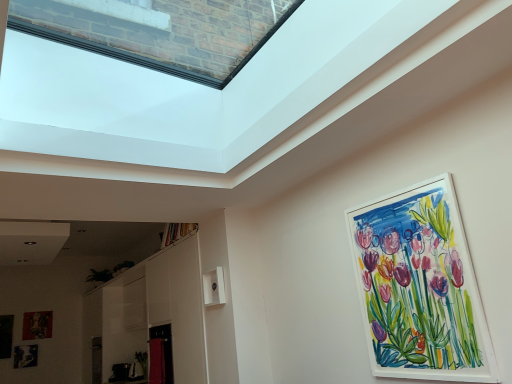
Locate an element on the screen. The width and height of the screenshot is (512, 384). matte black picture frame at lower left, the third picture frame from the top is located at coordinates (6, 336).

Find the location of a particular element. Image resolution: width=512 pixels, height=384 pixels. matte black picture frame at lower left, the second picture frame in the bottom-to-top sequence is located at coordinates (6, 336).

Would you say matte black picture frame at lower left, the third picture frame from the top, is part of metallic silver picture frame at lower left, arranged as the third picture frame when viewed from the right,'s contents?

Actually, matte black picture frame at lower left, the third picture frame from the top, is outside metallic silver picture frame at lower left, arranged as the third picture frame when viewed from the right.

Can you confirm if metallic silver picture frame at lower left, which is the 1th picture frame from bottom to top, is smaller than matte black picture frame at lower left, which is counted as the second picture frame, starting from the front?

Yes.

From the image's perspective, which one is positioned higher, metallic silver picture frame at lower left, which ranks as the 3th picture frame in front-to-back order, or matte black picture frame at lower left, the second picture frame in the bottom-to-top sequence?

matte black picture frame at lower left, the second picture frame in the bottom-to-top sequence, is shown above in the image.

Who is taller, metallic silver picture frame at lower left, which ranks as the 3th picture frame in front-to-back order, or matte black picture frame at lower left, the second picture frame in the bottom-to-top sequence?

matte black picture frame at lower left, the second picture frame in the bottom-to-top sequence.

Can you confirm if matte black picture frame at lower left, which is counted as the second picture frame, starting from the front, is shorter than watercolor paper painting at upper right, which ranks as the fourth picture frame in bottom-to-top order?

Indeed, matte black picture frame at lower left, which is counted as the second picture frame, starting from the front, has a lesser height compared to watercolor paper painting at upper right, which ranks as the fourth picture frame in bottom-to-top order.

Which object is further away from the camera taking this photo, matte black picture frame at lower left, which is counted as the second picture frame, starting from the front, or watercolor paper painting at upper right, the fourth picture frame from the back?

Positioned behind is matte black picture frame at lower left, which is counted as the second picture frame, starting from the front.

Considering the sizes of matte black picture frame at lower left, which is counted as the 4th picture frame, starting from the right, and watercolor paper painting at upper right, which ranks as the fourth picture frame in bottom-to-top order, in the image, is matte black picture frame at lower left, which is counted as the 4th picture frame, starting from the right, wider or thinner than watercolor paper painting at upper right, which ranks as the fourth picture frame in bottom-to-top order,?

Clearly, matte black picture frame at lower left, which is counted as the 4th picture frame, starting from the right, has more width compared to watercolor paper painting at upper right, which ranks as the fourth picture frame in bottom-to-top order.

Is watercolor paper painting at upper right, placed as the 1th picture frame when sorted from front to back, completely or partially inside matte black picture frame at lower left, the second picture frame in the bottom-to-top sequence?

No, watercolor paper painting at upper right, placed as the 1th picture frame when sorted from front to back, is not a part of matte black picture frame at lower left, the second picture frame in the bottom-to-top sequence.

Can you confirm if matte black picture frame at lower left, marked as the third picture frame in a left-to-right arrangement, is smaller than watercolor paper painting at upper right, marked as the 1th picture frame in a top-to-bottom arrangement?

Yes, matte black picture frame at lower left, marked as the third picture frame in a left-to-right arrangement, is smaller than watercolor paper painting at upper right, marked as the 1th picture frame in a top-to-bottom arrangement.

Could you tell me if matte black picture frame at lower left, which is counted as the 4th picture frame, starting from the front, is turned towards watercolor paper painting at upper right, placed as the 1th picture frame when sorted from front to back?

Yes.

Considering the points (48, 321) and (422, 349), which point is in front, point (48, 321) or point (422, 349)?

The point (422, 349) is more forward.

Is watercolor paper painting at upper right, which ranks as the fourth picture frame in bottom-to-top order, a part of matte black picture frame at lower left, which is counted as the 4th picture frame, starting from the front?

Actually, watercolor paper painting at upper right, which ranks as the fourth picture frame in bottom-to-top order, is outside matte black picture frame at lower left, which is counted as the 4th picture frame, starting from the front.

Are matte black picture frame at lower left, marked as the second picture frame in a right-to-left arrangement, and matte black picture frame at lower left, the third picture frame from the top, located far from each other?

No, there isn't a large distance between matte black picture frame at lower left, marked as the second picture frame in a right-to-left arrangement, and matte black picture frame at lower left, the third picture frame from the top.

Could you tell me if matte black picture frame at lower left, marked as the third picture frame in a left-to-right arrangement, is turned towards matte black picture frame at lower left, the third picture frame from the top?

No, matte black picture frame at lower left, marked as the third picture frame in a left-to-right arrangement, is not turned towards matte black picture frame at lower left, the third picture frame from the top.

From the image's perspective, which one is positioned higher, matte black picture frame at lower left, which is the 2th picture frame from top to bottom, or matte black picture frame at lower left, the third picture frame from the top?

matte black picture frame at lower left, which is the 2th picture frame from top to bottom, appears higher in the image.

Looking at this image, is watercolor paper painting at upper right, the fourth picture frame from the back, shorter than metallic silver picture frame at lower left, which ranks as the 3th picture frame in front-to-back order?

Incorrect, the height of watercolor paper painting at upper right, the fourth picture frame from the back, does not fall short of that of metallic silver picture frame at lower left, which ranks as the 3th picture frame in front-to-back order.

Are watercolor paper painting at upper right, the fourth picture frame from the back, and metallic silver picture frame at lower left, which is counted as the 4th picture frame, starting from the top, beside each other?

No, watercolor paper painting at upper right, the fourth picture frame from the back, is not touching metallic silver picture frame at lower left, which is counted as the 4th picture frame, starting from the top.

Is watercolor paper painting at upper right, the fourth picture frame from the back, bigger than metallic silver picture frame at lower left, arranged as the third picture frame when viewed from the right?

Indeed, watercolor paper painting at upper right, the fourth picture frame from the back, has a larger size compared to metallic silver picture frame at lower left, arranged as the third picture frame when viewed from the right.

From a real-world perspective, starting from the matte black picture frame at lower left, which is the 2th picture frame from top to bottom, which picture frame is the 3rd one below it? Please provide its 2D coordinates.

[(25, 356)]

Based on the photo, can you confirm if matte black picture frame at lower left, which is counted as the 3th picture frame, starting from the bottom, is smaller than metallic silver picture frame at lower left, arranged as the third picture frame when viewed from the right?

No.

From the image's perspective, is matte black picture frame at lower left, which is counted as the 3th picture frame, starting from the bottom, under metallic silver picture frame at lower left, which ranks as the 3th picture frame in front-to-back order?

No.

Which of these two, matte black picture frame at lower left, which ranks as the first picture frame in back-to-front order, or metallic silver picture frame at lower left, which is counted as the 4th picture frame, starting from the top, stands shorter?

metallic silver picture frame at lower left, which is counted as the 4th picture frame, starting from the top, is shorter.

Is point (4, 328) closer or farther from the camera than point (35, 366)?

Point (4, 328) is farther from the camera than point (35, 366).

Which object is positioned more to the right, matte black picture frame at lower left, which is counted as the 4th picture frame, starting from the right, or metallic silver picture frame at lower left, which is counted as the 4th picture frame, starting from the top?

metallic silver picture frame at lower left, which is counted as the 4th picture frame, starting from the top, is more to the right.

Are matte black picture frame at lower left, the 1th picture frame viewed from the left, and metallic silver picture frame at lower left, arranged as the third picture frame when viewed from the right, far apart?

No.

How different are the orientations of matte black picture frame at lower left, which is counted as the 4th picture frame, starting from the right, and metallic silver picture frame at lower left, arranged as the third picture frame when viewed from the right, in degrees?

There is a 4.48-degree angle between the facing directions of matte black picture frame at lower left, which is counted as the 4th picture frame, starting from the right, and metallic silver picture frame at lower left, arranged as the third picture frame when viewed from the right.

Which picture frame is the 1st one when counting from the back of the matte black picture frame at lower left, the 1th picture frame viewed from the left? Please provide its 2D coordinates.

[(25, 356)]

Locate an element on the screen. The image size is (512, 384). picture frame that is the 2nd one when counting upward from the matte black picture frame at lower left, the 3th picture frame from the back (from the image's perspective) is located at coordinates (420, 287).

Which object lies further to the anchor point matte black picture frame at lower left, which is counted as the 4th picture frame, starting from the right, watercolor paper painting at upper right, the 4th picture frame when ordered from left to right, or metallic silver picture frame at lower left, which is counted as the 4th picture frame, starting from the top?

watercolor paper painting at upper right, the 4th picture frame when ordered from left to right, lies further to matte black picture frame at lower left, which is counted as the 4th picture frame, starting from the right, than the other object.

Which object lies nearer to the anchor point watercolor paper painting at upper right, the 4th picture frame when ordered from left to right, matte black picture frame at lower left, the third picture frame from the top, or metallic silver picture frame at lower left, which is the 1th picture frame from bottom to top?

Among the two, metallic silver picture frame at lower left, which is the 1th picture frame from bottom to top, is located nearer to watercolor paper painting at upper right, the 4th picture frame when ordered from left to right.

From the image, which object appears to be farther from watercolor paper painting at upper right, marked as the 1th picture frame in a top-to-bottom arrangement, matte black picture frame at lower left, marked as the second picture frame in a right-to-left arrangement, or metallic silver picture frame at lower left, which is the 2th picture frame in back-to-front order?

metallic silver picture frame at lower left, which is the 2th picture frame in back-to-front order, lies further to watercolor paper painting at upper right, marked as the 1th picture frame in a top-to-bottom arrangement, than the other object.

Considering their positions, is matte black picture frame at lower left, the 1th picture frame viewed from the left, positioned further to matte black picture frame at lower left, which is counted as the 4th picture frame, starting from the front, than metallic silver picture frame at lower left, which is the 1th picture frame from bottom to top?

Based on the image, matte black picture frame at lower left, the 1th picture frame viewed from the left, appears to be further to matte black picture frame at lower left, which is counted as the 4th picture frame, starting from the front.

When comparing their distances from matte black picture frame at lower left, the 1th picture frame viewed from the left, does watercolor paper painting at upper right, the fourth picture frame from the back, or matte black picture frame at lower left, which ranks as the first picture frame in back-to-front order, seem further?

watercolor paper painting at upper right, the fourth picture frame from the back.

Considering their positions, is matte black picture frame at lower left, which is counted as the 4th picture frame, starting from the right, positioned further to matte black picture frame at lower left, which ranks as the first picture frame in back-to-front order, than watercolor paper painting at upper right, the fourth picture frame from the back?

Based on the image, watercolor paper painting at upper right, the fourth picture frame from the back, appears to be further to matte black picture frame at lower left, which ranks as the first picture frame in back-to-front order.

Considering their positions, is watercolor paper painting at upper right, the 4th picture frame when ordered from left to right, positioned further to matte black picture frame at lower left, marked as the second picture frame in a right-to-left arrangement, than metallic silver picture frame at lower left, which is the 1th picture frame from bottom to top?

watercolor paper painting at upper right, the 4th picture frame when ordered from left to right, is positioned further to the anchor matte black picture frame at lower left, marked as the second picture frame in a right-to-left arrangement.

Looking at the image, which one is located further to metallic silver picture frame at lower left, which ranks as the 3th picture frame in front-to-back order, matte black picture frame at lower left, which is counted as the 4th picture frame, starting from the front, or matte black picture frame at lower left, the third picture frame from the top?

matte black picture frame at lower left, which is counted as the 4th picture frame, starting from the front, is positioned further to the anchor metallic silver picture frame at lower left, which ranks as the 3th picture frame in front-to-back order.

Where is `picture frame between watercolor paper painting at upper right, the 1th picture frame when ordered from right to left, and metallic silver picture frame at lower left, which is the 2th picture frame in back-to-front order, along the z-axis`? Image resolution: width=512 pixels, height=384 pixels. picture frame between watercolor paper painting at upper right, the 1th picture frame when ordered from right to left, and metallic silver picture frame at lower left, which is the 2th picture frame in back-to-front order, along the z-axis is located at coordinates (6, 336).

Locate an element on the screen. picture frame between matte black picture frame at lower left, which is the 2th picture frame from top to bottom, and metallic silver picture frame at lower left, which is the 1th picture frame from bottom to top, in the up-down direction is located at coordinates (6, 336).